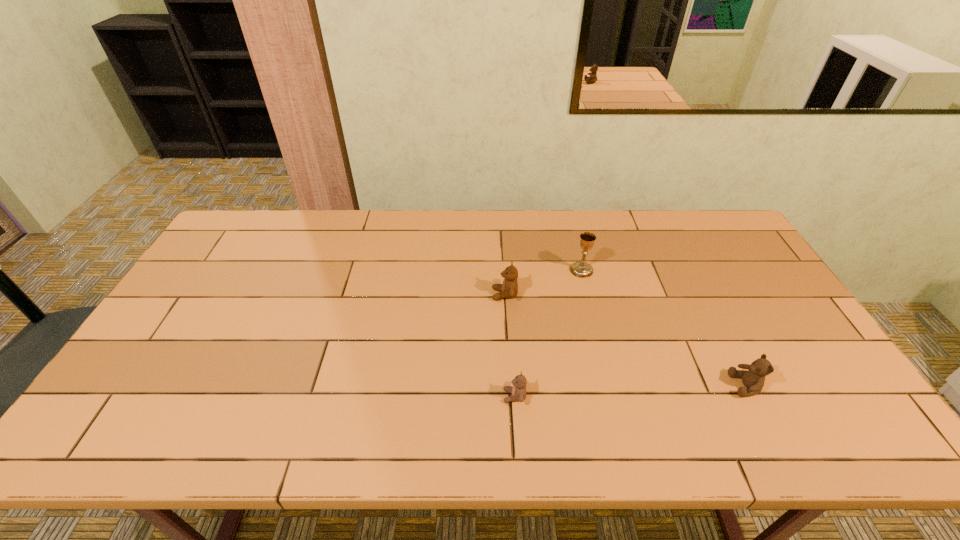
Locate an element on the screen. the farthest object is located at coordinates (581, 269).

Locate an element on the screen. the second object from right to left is located at coordinates (581, 269).

Find the location of a particular element. The width and height of the screenshot is (960, 540). the second farthest object is located at coordinates (509, 289).

The height and width of the screenshot is (540, 960). In order to click on the third tallest object in this screenshot , I will do `click(753, 379)`.

Locate an element on the screen. This screenshot has height=540, width=960. the rightmost object is located at coordinates (753, 379).

Find the location of a particular element. Image resolution: width=960 pixels, height=540 pixels. the shortest object is located at coordinates (518, 391).

Find the location of a particular element. This screenshot has height=540, width=960. free region located 0.400m on the left of the farthest object is located at coordinates (444, 270).

This screenshot has height=540, width=960. I want to click on vacant area located on the front-facing side of the second farthest object, so click(409, 294).

Where is `vacant area situated 0.310m on the front-facing side of the second farthest object`? This screenshot has height=540, width=960. vacant area situated 0.310m on the front-facing side of the second farthest object is located at coordinates (389, 294).

Where is `free space located on the front-facing side of the second farthest object`? free space located on the front-facing side of the second farthest object is located at coordinates (416, 294).